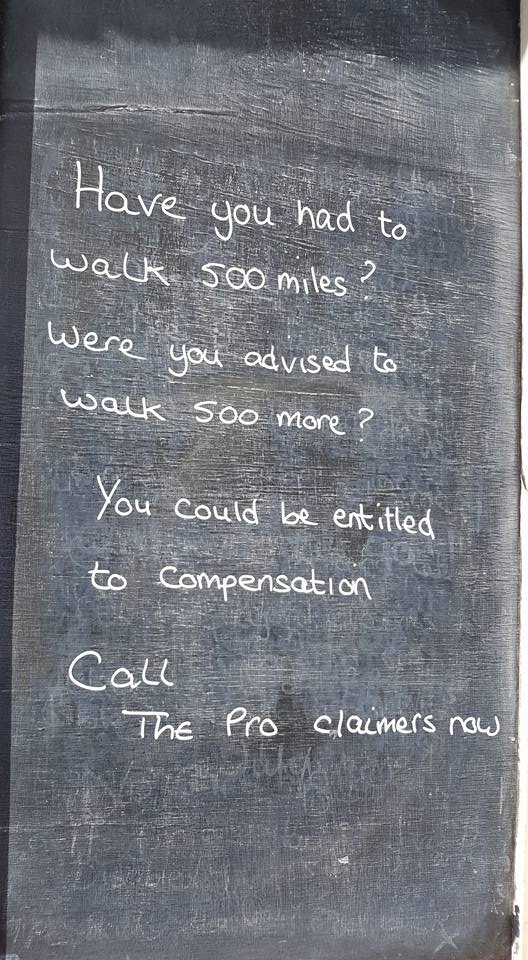
Find the location of a particular element. blackboard is located at coordinates (143, 32), (464, 622), (172, 870), (413, 871), (279, 654), (173, 317).